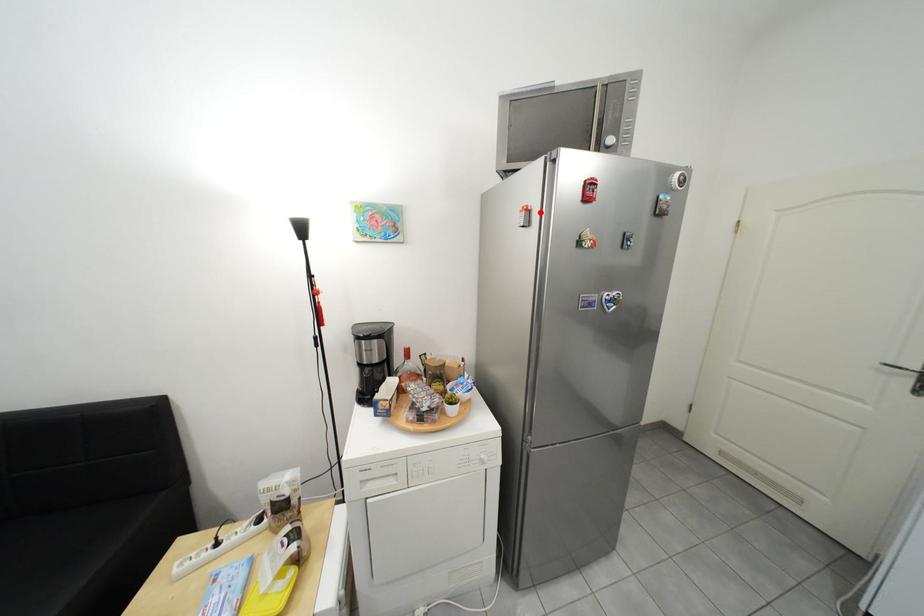
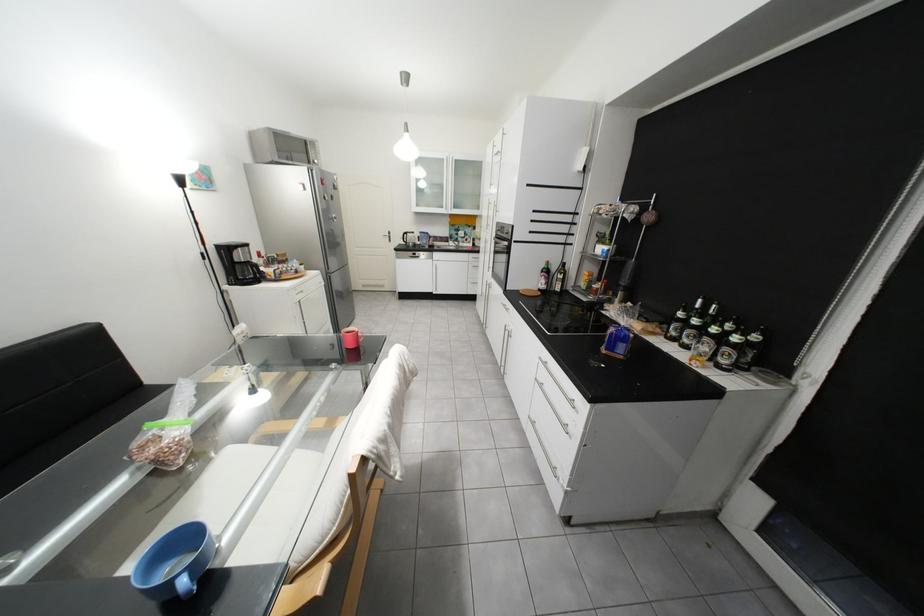
In the second image, find the point that corresponds to the highlighted location in the first image.

(315, 185)